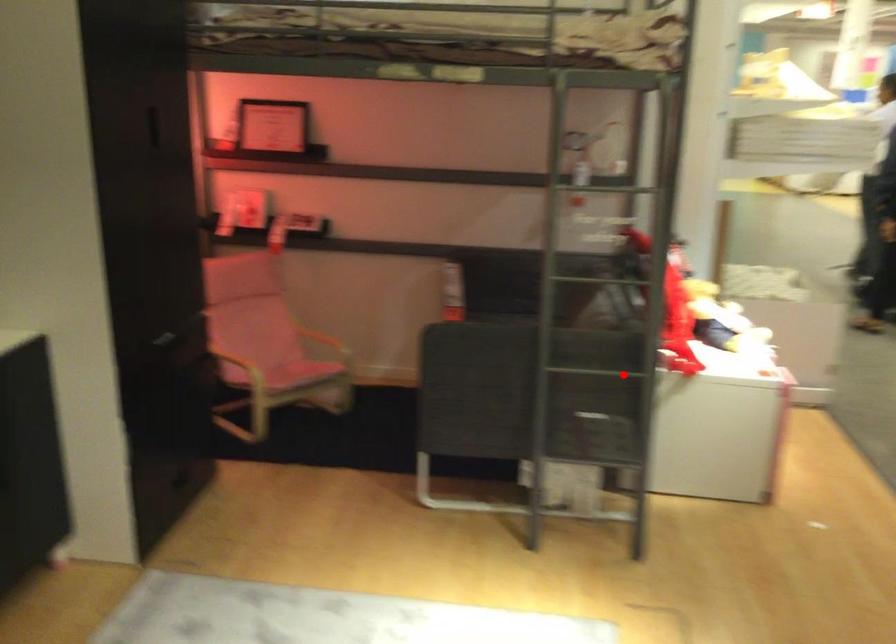
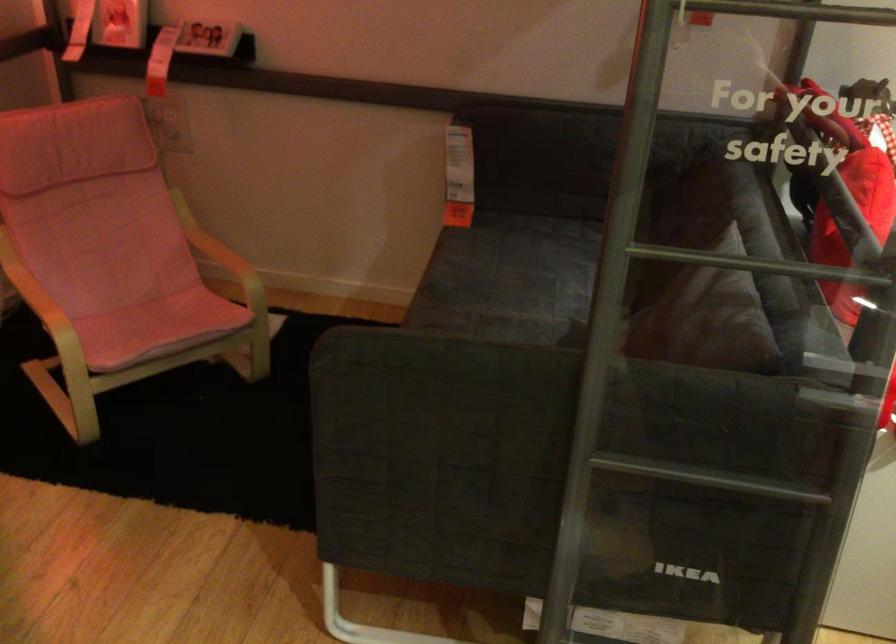
Question: I am providing you with two images of the same scene from different viewpoints. In image1, a red point is highlighted. Considering the same 3D point in image2, which of the following is correct?

Choices:
 (A) It is closer
 (B) It is farther

Answer: (A)